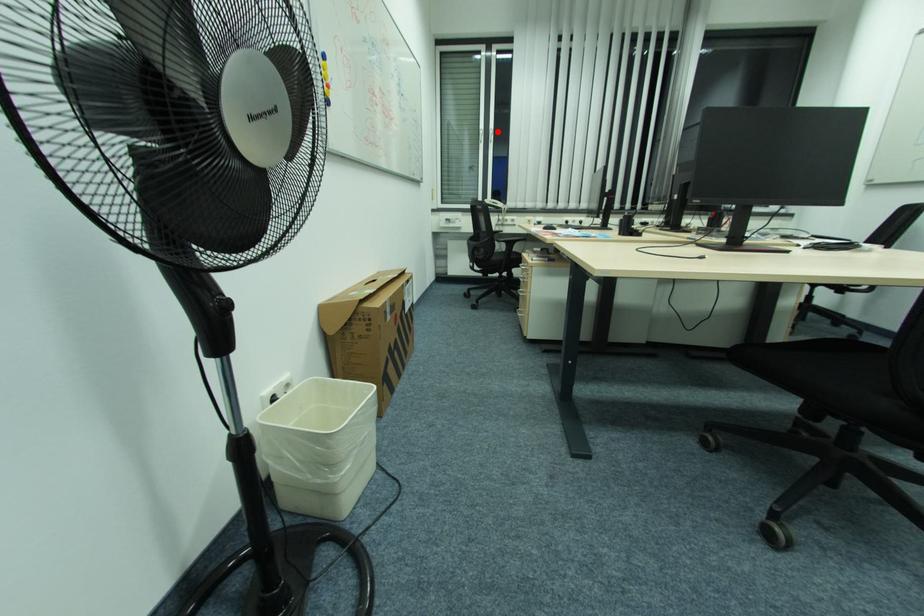
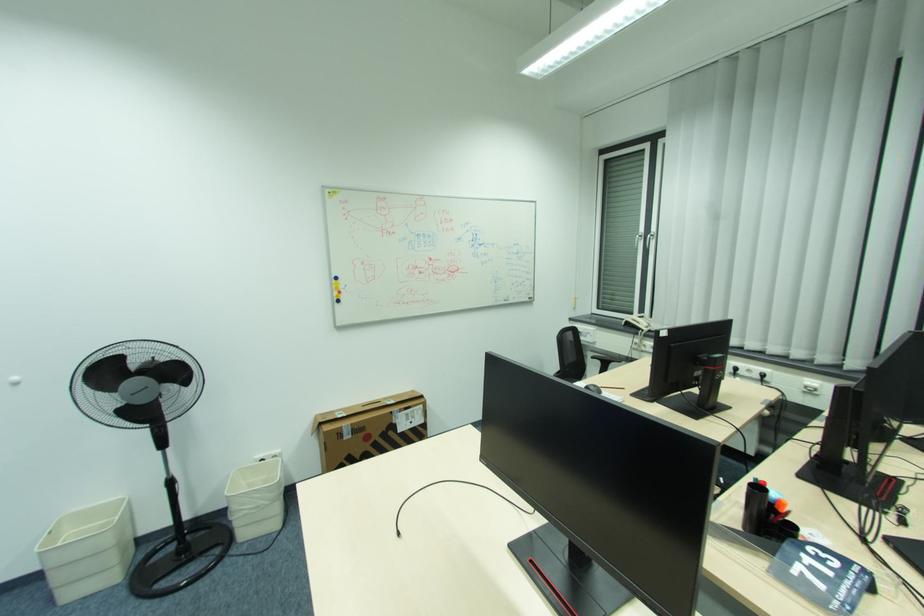
Question: I am providing you with two images of the same scene from different viewpoints. In image1, a red point is highlighted. Considering the same 3D point in image2, which of the following is correct?

Choices:
 (A) It is closer
 (B) It is farther

Answer: (A)